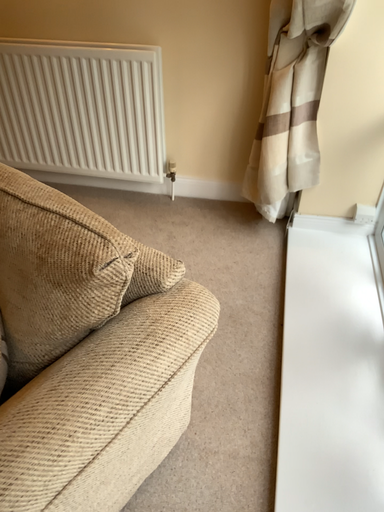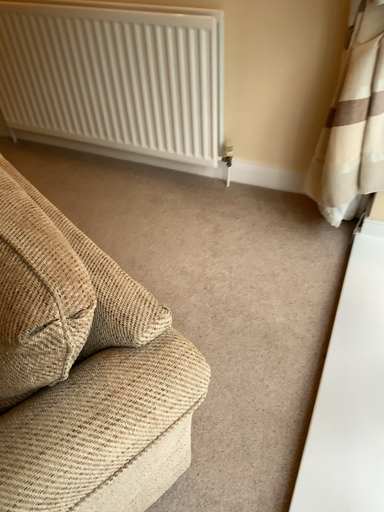
Question: Which way did the camera rotate in the video?

Choices:
 (A) rotated left
 (B) rotated right

Answer: (A)